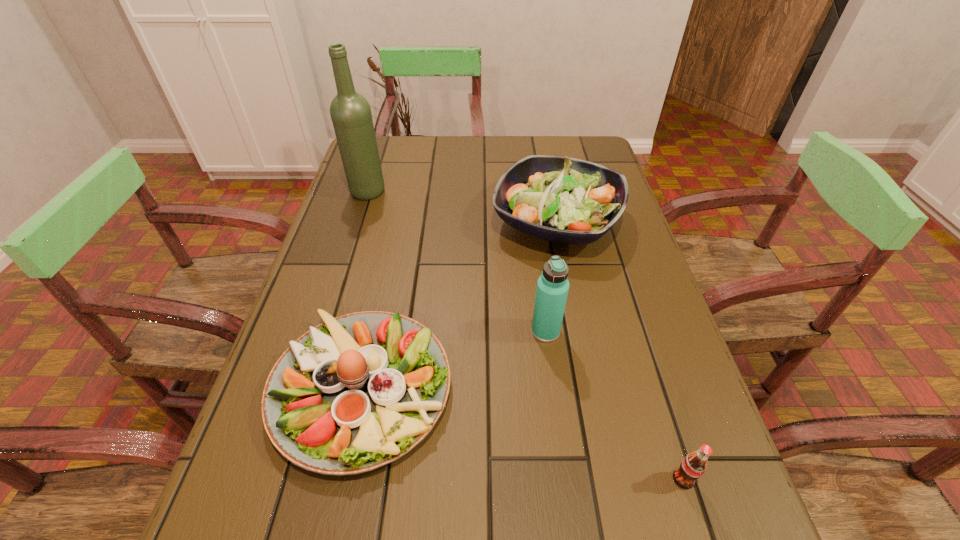
Where is `vacant region between the fourth shortest object and the nearer salad plate`? Image resolution: width=960 pixels, height=540 pixels. vacant region between the fourth shortest object and the nearer salad plate is located at coordinates (454, 360).

The width and height of the screenshot is (960, 540). In order to click on the closest object to the wine bottle in this screenshot , I will do `click(566, 200)`.

In order to click on object that is the third nearest to the farther salad plate in this screenshot , I will do pos(350,112).

This screenshot has width=960, height=540. In order to click on free point that satisfies the following two spatial constraints: 1. on the front side of the wine bottle; 2. on the right side of the left salad plate in this screenshot , I will do `click(306, 389)`.